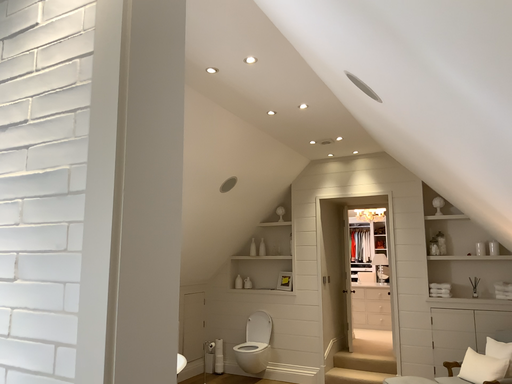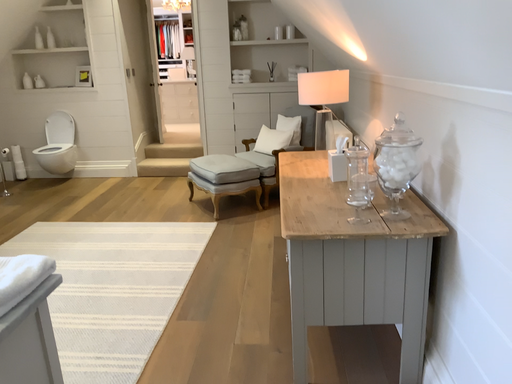
Question: How did the camera likely rotate when shooting the video?

Choices:
 (A) rotated upward
 (B) rotated downward

Answer: (B)